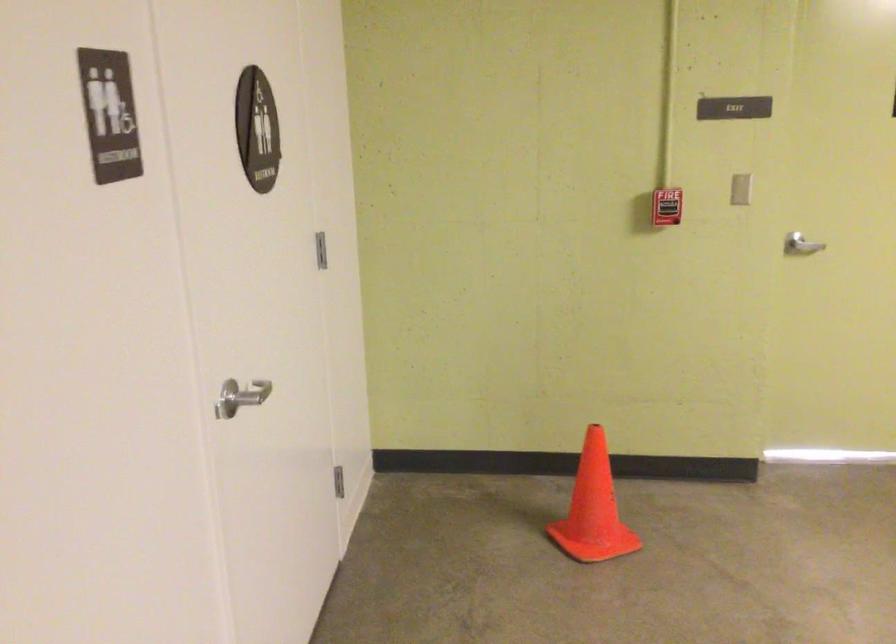
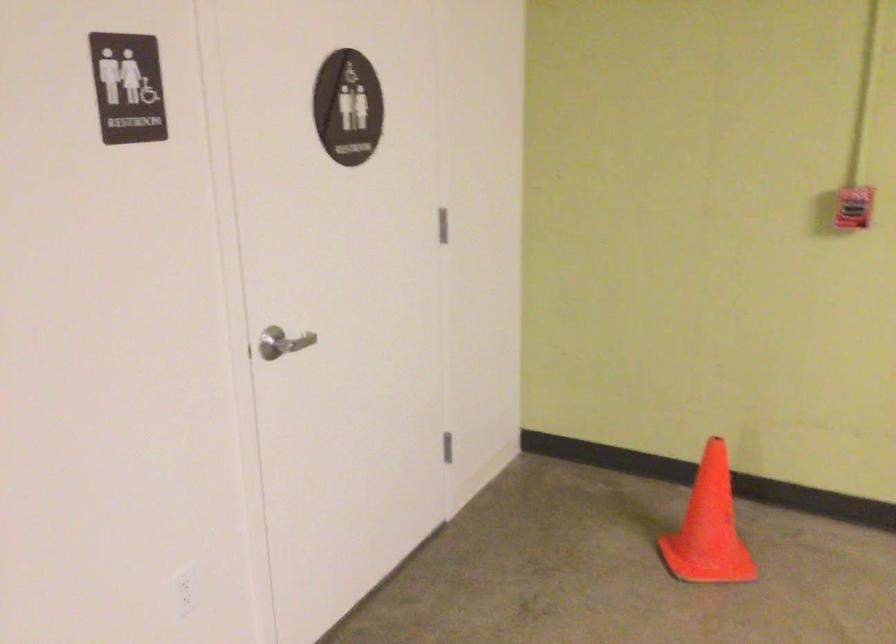
Question: The camera is either moving clockwise (left) or counter-clockwise (right) around the object. The first image is from the beginning of the video and the second image is from the end. Is the camera moving left or right when shooting the video?

Choices:
 (A) Left
 (B) Right

Answer: (B)